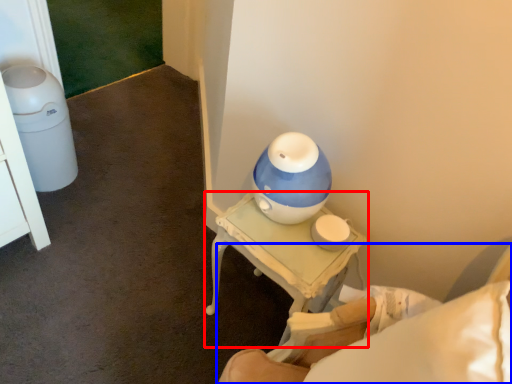
Question: Which object appears farthest to the camera in this image, table (highlighted by a red box) or furniture (highlighted by a blue box)?

Choices:
 (A) table
 (B) furniture

Answer: (A)